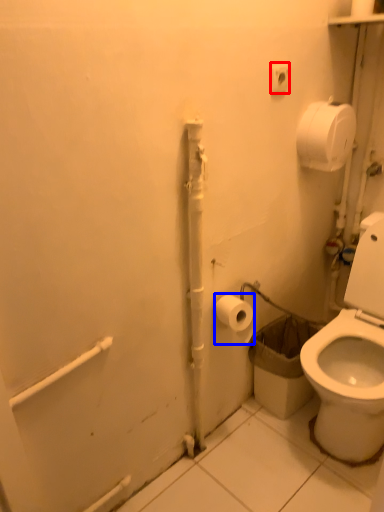
Question: Which object is further to the camera taking this photo, electric outlet (highlighted by a red box) or toilet paper (highlighted by a blue box)?

Choices:
 (A) electric outlet
 (B) toilet paper

Answer: (B)